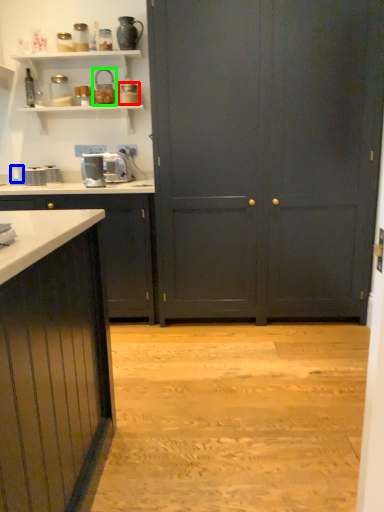
Question: Which object is the closest to the appliance (highlighted by a red box)? Choose among these: appliance (highlighted by a blue box) or appliance (highlighted by a green box).

Choices:
 (A) appliance
 (B) appliance

Answer: (B)